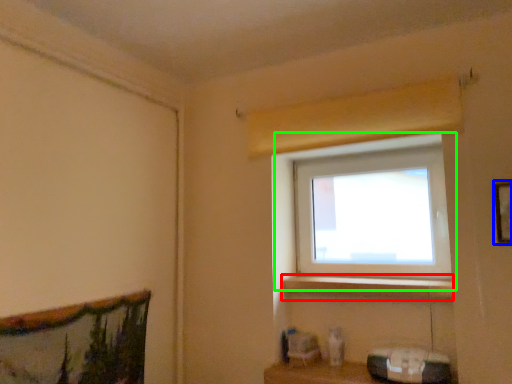
Question: Which object is the farthest from window sill (highlighted by a red box)? Choose among these: picture frame (highlighted by a blue box) or window (highlighted by a green box).

Choices:
 (A) picture frame
 (B) window

Answer: (A)